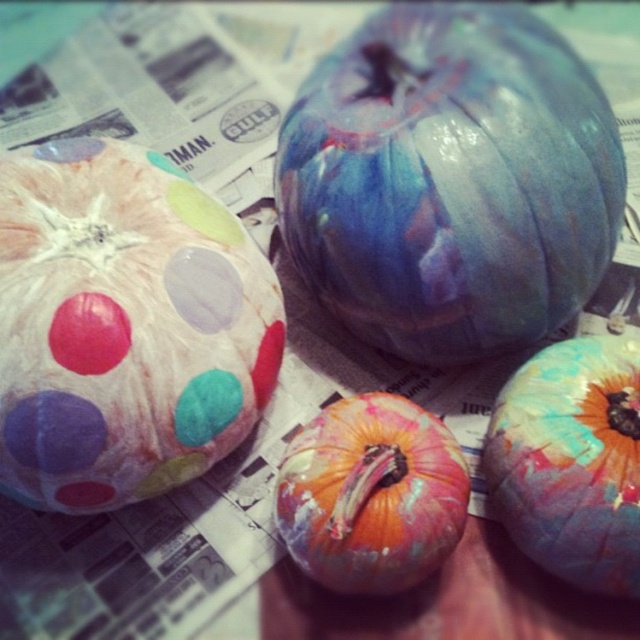
Is polka-dotted pumpkin at upper left shorter than multicolored painted pumpkin at center?

No.

This screenshot has width=640, height=640. Find the location of `polka-dotted pumpkin at upper left`. polka-dotted pumpkin at upper left is located at coordinates (124, 326).

Is marbled blue pumpkin at center closer to the viewer compared to polka-dotted pumpkin at upper left?

No, marbled blue pumpkin at center is behind polka-dotted pumpkin at upper left.

Is marbled blue pumpkin at center bigger than polka-dotted pumpkin at upper left?

Correct, marbled blue pumpkin at center is larger in size than polka-dotted pumpkin at upper left.

Image resolution: width=640 pixels, height=640 pixels. What are the coordinates of `marbled blue pumpkin at center` in the screenshot? It's located at (451, 180).

Where is `marbled blue pumpkin at center`? This screenshot has height=640, width=640. marbled blue pumpkin at center is located at coordinates (451, 180).

Which is in front, point (442, 19) or point (458, 518)?

Point (458, 518)

Which is more to the right, marbled blue pumpkin at center or multicolored painted pumpkin at center?

From the viewer's perspective, marbled blue pumpkin at center appears more on the right side.

Between point (403, 340) and point (384, 438), which one is positioned behind?

The point (403, 340) is more distant.

Locate an element on the screen. The image size is (640, 640). marbled blue pumpkin at center is located at coordinates (451, 180).